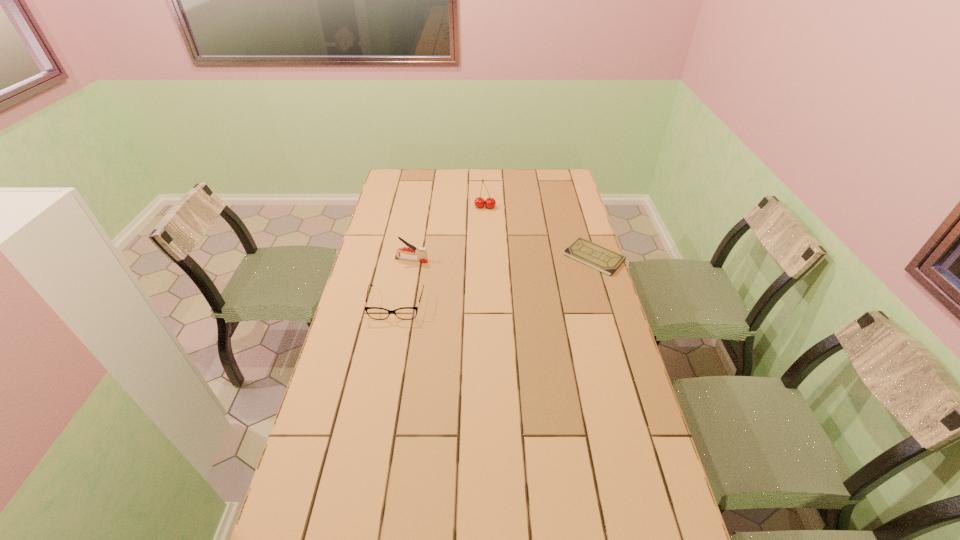
The height and width of the screenshot is (540, 960). I want to click on free space on the desktop that is between the nearest object and the checkbook and is positioned on the handle side of the stapler, so click(x=522, y=274).

The width and height of the screenshot is (960, 540). What are the coordinates of `vacant space on the desktop that is between the second shortest object and the shortest object and is positioned with the stems of the farthest object pointing upwards` in the screenshot? It's located at (478, 285).